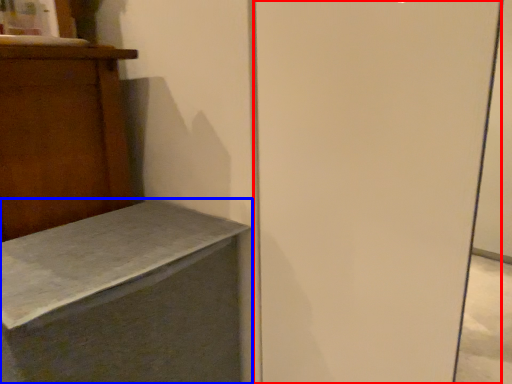
Question: Which of the following is the closest to the observer, screen door (highlighted by a red box) or furniture (highlighted by a blue box)?

Choices:
 (A) screen door
 (B) furniture

Answer: (A)